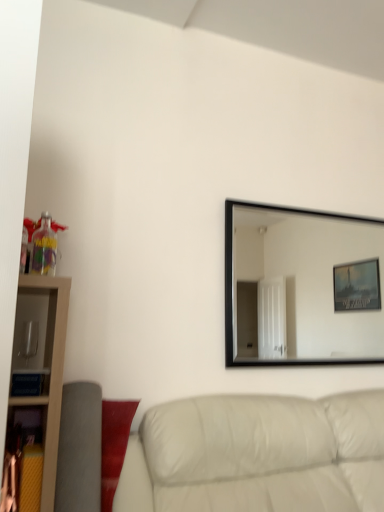
Question: Looking at their shapes, would you say black frame mirror at upper right is wider or thinner than white leather couch at lower right?

Choices:
 (A) thin
 (B) wide

Answer: (A)

Question: From a real-world perspective, relative to white leather couch at lower right, is black frame mirror at upper right vertically above or below?

Choices:
 (A) below
 (B) above

Answer: (B)

Question: Considering the positions of black frame mirror at upper right and white leather couch at lower right in the image, is black frame mirror at upper right taller or shorter than white leather couch at lower right?

Choices:
 (A) short
 (B) tall

Answer: (B)

Question: From the image's perspective, is white leather couch at lower right above or below black frame mirror at upper right?

Choices:
 (A) above
 (B) below

Answer: (B)

Question: Is point (279, 458) closer or farther from the camera than point (329, 315)?

Choices:
 (A) farther
 (B) closer

Answer: (B)

Question: In the image, is white leather couch at lower right on the left side or the right side of black frame mirror at upper right?

Choices:
 (A) left
 (B) right

Answer: (A)

Question: From a real-world perspective, is white leather couch at lower right above or below black frame mirror at upper right?

Choices:
 (A) below
 (B) above

Answer: (A)